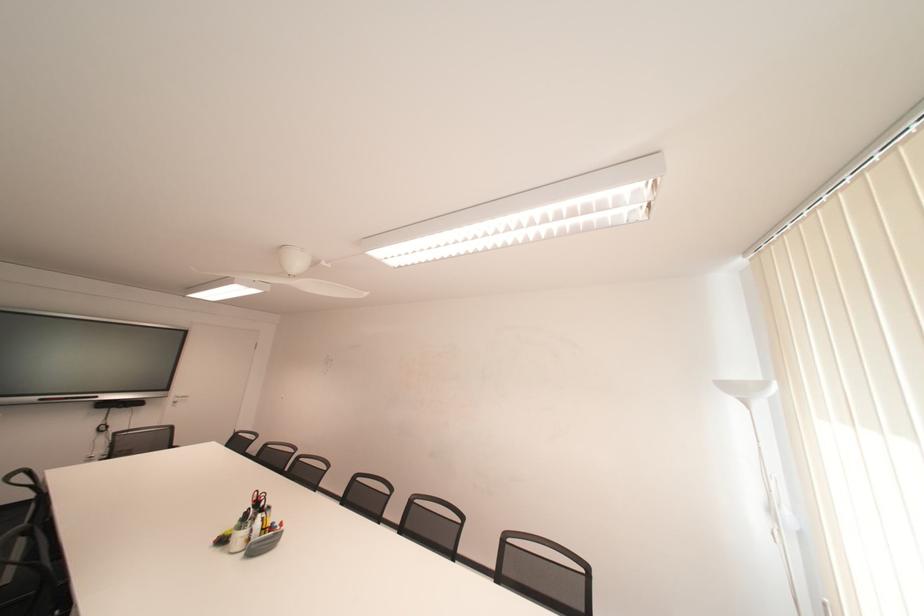
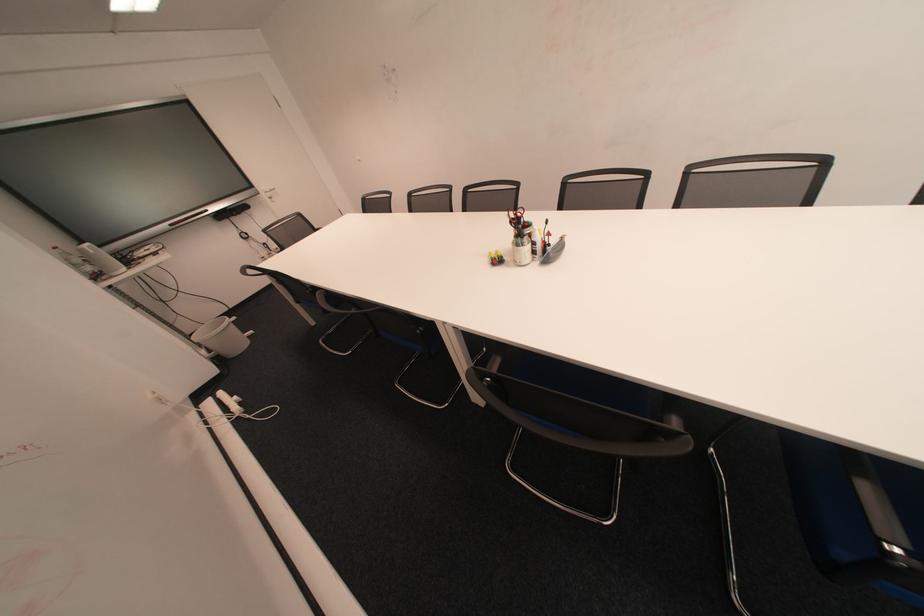
Locate, in the second image, the point that corresponds to pixel 254 554 in the first image.

(550, 262)